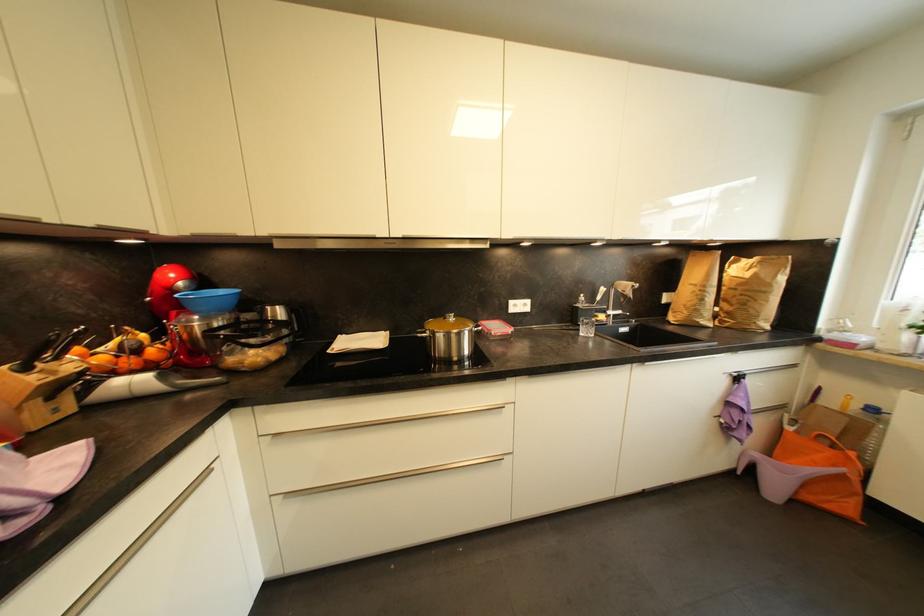
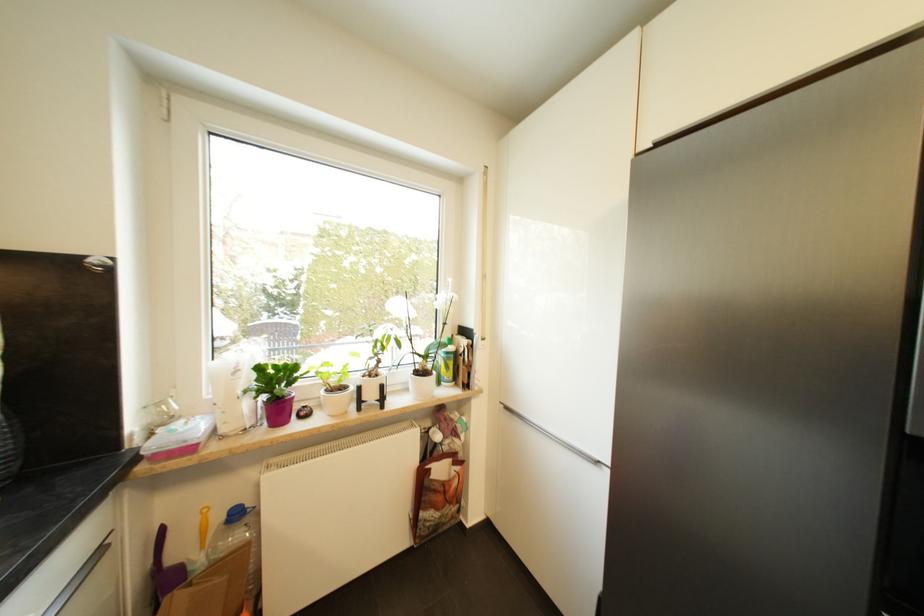
Locate, in the second image, the point that corresponds to [853,392] in the first image.

(207, 507)